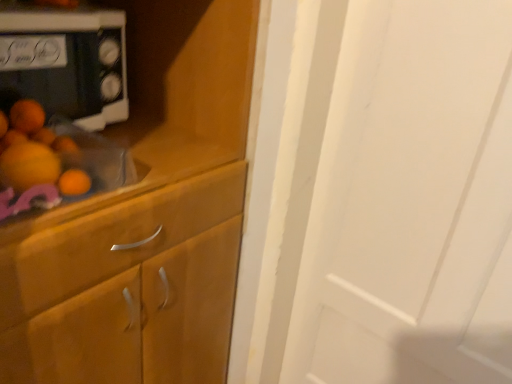
Question: Would you say wooden cabinet at left is inside or outside white glossy microwave at upper left?

Choices:
 (A) outside
 (B) inside

Answer: (A)

Question: In terms of width, does wooden cabinet at left look wider or thinner when compared to white glossy microwave at upper left?

Choices:
 (A) thin
 (B) wide

Answer: (B)

Question: From their relative heights in the image, would you say wooden cabinet at left is taller or shorter than white glossy microwave at upper left?

Choices:
 (A) tall
 (B) short

Answer: (A)

Question: Visually, is white glossy microwave at upper left positioned to the left or to the right of wooden cabinet at left?

Choices:
 (A) left
 (B) right

Answer: (B)

Question: From a real-world perspective, relative to wooden cabinet at left, is white glossy microwave at upper left vertically above or below?

Choices:
 (A) below
 (B) above

Answer: (B)

Question: Looking at their shapes, would you say white glossy microwave at upper left is wider or thinner than wooden cabinet at left?

Choices:
 (A) thin
 (B) wide

Answer: (A)

Question: Choose the correct answer: Is white glossy microwave at upper left inside wooden cabinet at left or outside it?

Choices:
 (A) inside
 (B) outside

Answer: (B)